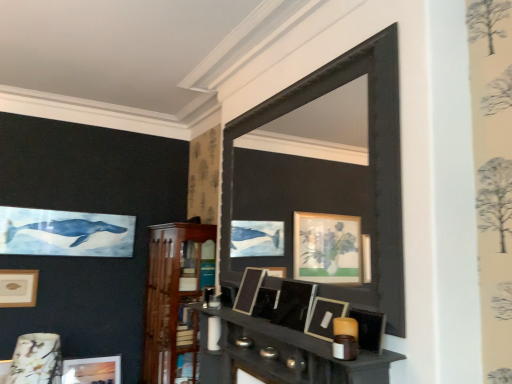
Question: From the image's perspective, is matte black picture frame at center, the 1th picture frame from the top, located above matte wooden picture frame at lower left, the first picture frame in the bottom-to-top sequence?

Choices:
 (A) yes
 (B) no

Answer: (A)

Question: Does matte black picture frame at center, which is the first picture frame from front to back, have a lesser width compared to matte wooden picture frame at lower left, which is the 4th picture frame in right-to-left order?

Choices:
 (A) no
 (B) yes

Answer: (B)

Question: Does matte black picture frame at center, which is counted as the fifth picture frame, starting from the left, have a smaller size compared to matte wooden picture frame at lower left, which is counted as the fifth picture frame, starting from the front?

Choices:
 (A) no
 (B) yes

Answer: (B)

Question: Is matte wooden picture frame at lower left, the first picture frame in the bottom-to-top sequence, completely or partially inside matte black picture frame at center, which is the first picture frame from front to back?

Choices:
 (A) yes
 (B) no

Answer: (B)

Question: From a real-world perspective, is matte black picture frame at center, the fifth picture frame when ordered from back to front, under matte wooden picture frame at lower left, the first picture frame in the bottom-to-top sequence?

Choices:
 (A) no
 (B) yes

Answer: (A)

Question: Looking at their shapes, would you say matte black picture frame at center, which is the 3th picture frame in front-to-back order, is wider or thinner than wooden shelf at center, the second shelf in the right-to-left sequence?

Choices:
 (A) wide
 (B) thin

Answer: (B)

Question: Is point (238, 289) closer or farther from the camera than point (175, 374)?

Choices:
 (A) closer
 (B) farther

Answer: (A)

Question: From a real-world perspective, is matte black picture frame at center, which is the 3th picture frame in front-to-back order, physically located above or below wooden shelf at center, arranged as the first shelf when viewed from the back?

Choices:
 (A) below
 (B) above

Answer: (B)

Question: From their relative heights in the image, would you say matte black picture frame at center, which appears as the second picture frame when viewed from the top, is taller or shorter than wooden shelf at center, the 2th shelf from the front?

Choices:
 (A) tall
 (B) short

Answer: (B)

Question: Based on their positions, is matte black picture frame at center, which is counted as the 5th picture frame, starting from the bottom, located to the left or right of wooden shelf at center, arranged as the 1th shelf when viewed from the left?

Choices:
 (A) left
 (B) right

Answer: (B)

Question: Is matte black picture frame at center, the first picture frame when ordered from right to left, in front of or behind wooden shelf at center, arranged as the 1th shelf when viewed from the left, in the image?

Choices:
 (A) behind
 (B) front

Answer: (B)

Question: From the image's perspective, relative to wooden shelf at center, arranged as the 1th shelf when viewed from the left, is matte black picture frame at center, the 1th picture frame from the top, above or below?

Choices:
 (A) below
 (B) above

Answer: (B)

Question: In terms of height, does matte black picture frame at center, the fifth picture frame when ordered from back to front, look taller or shorter compared to wooden shelf at center, arranged as the first shelf when viewed from the back?

Choices:
 (A) short
 (B) tall

Answer: (A)

Question: Does point pyautogui.click(x=292, y=288) appear closer or farther from the camera than point pyautogui.click(x=9, y=289)?

Choices:
 (A) farther
 (B) closer

Answer: (B)

Question: Considering the positions of matte black picture frame at center, the fifth picture frame when ordered from back to front, and matte gold picture frame at upper left, placed as the fourth picture frame when sorted from front to back, in the image, is matte black picture frame at center, the fifth picture frame when ordered from back to front, taller or shorter than matte gold picture frame at upper left, placed as the fourth picture frame when sorted from front to back,?

Choices:
 (A) tall
 (B) short

Answer: (B)